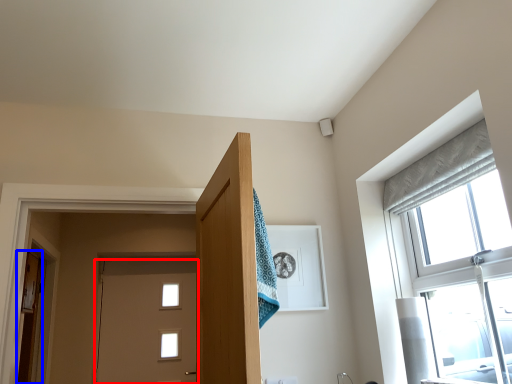
Question: Which of the following is the farthest to the observer, door (highlighted by a red box) or door (highlighted by a blue box)?

Choices:
 (A) door
 (B) door

Answer: (A)